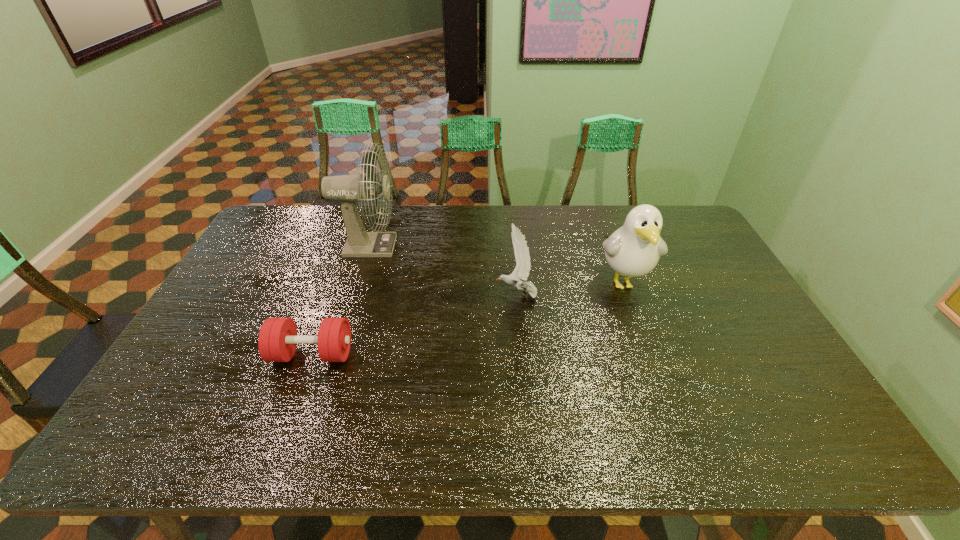
Where is `vacant area that satisfies the following two spatial constraints: 1. on the beak of the third shortest object; 2. at the tip of the beak of the third tallest object`? vacant area that satisfies the following two spatial constraints: 1. on the beak of the third shortest object; 2. at the tip of the beak of the third tallest object is located at coordinates (629, 295).

Find the location of a particular element. vacant point that satisfies the following two spatial constraints: 1. at the tip of the beak of the second object from right to left; 2. on the front side of the nearest object is located at coordinates [522, 354].

In order to click on vacant point that satisfies the following two spatial constraints: 1. on the beak of the right gull; 2. at the tip of the beak of the second object from right to left in this screenshot , I will do `click(629, 295)`.